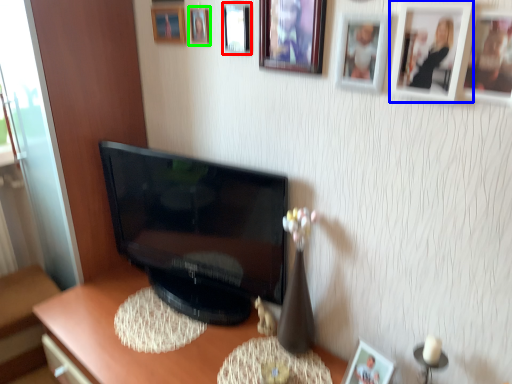
Question: Based on their relative distances, which object is nearer to picture frame (highlighted by a red box)? Choose from picture frame (highlighted by a blue box) and picture frame (highlighted by a green box).

Choices:
 (A) picture frame
 (B) picture frame

Answer: (B)